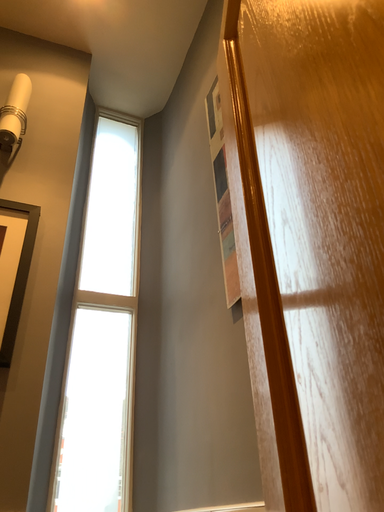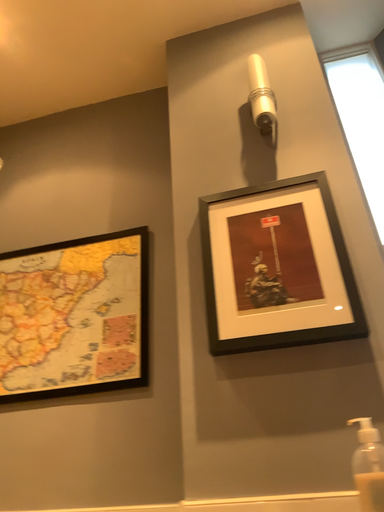
Question: Which way did the camera rotate in the video?

Choices:
 (A) rotated upward
 (B) rotated downward

Answer: (B)